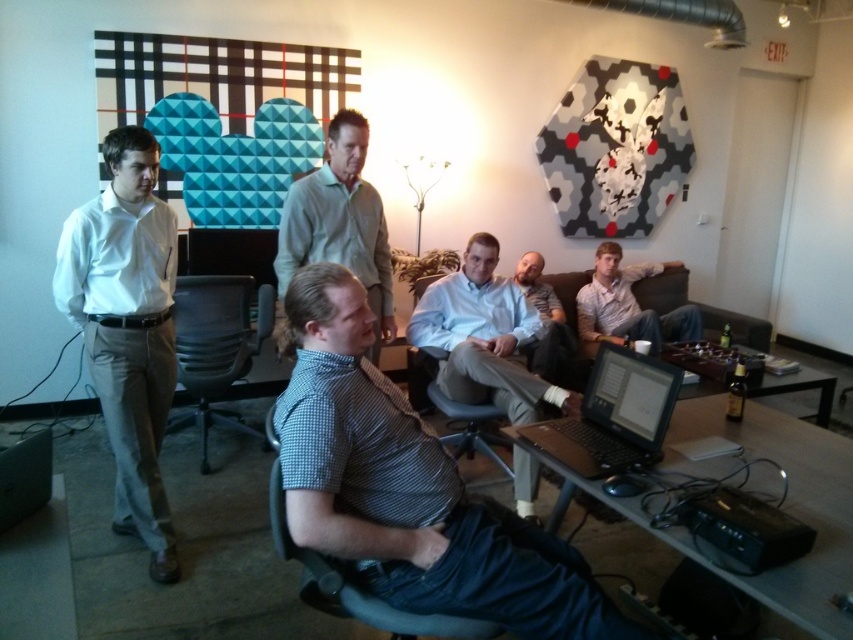
You are organizing a photo shoot and need to ensure that the checkered shirt at center and the light blue shirt at center are visible in the frame. Based on their sizes, which shirt should you focus on to ensure both are fully visible?

The checkered shirt at center has a larger size compared to light blue shirt at center, so focusing on the checkered shirt at center will help ensure both shirts are fully visible in the frame.

You are standing in the office and need to determine which of the two shirts, the light gray shirt at center or the light blue shirt at center, is taller. Based on the scene description, which one is taller?

The light gray shirt at center is taller than the light blue shirt at center according to the description.

You are organizing a photoshoot in this office and need to ensure that the white smooth shirt at left and the black plastic laptop at center are visible in the frame. Given that the camera has a fixed width of 50 cm, will both objects fit side by side horizontally?

The white smooth shirt at left is narrower than the black plastic laptop at center. However, without knowing the exact widths of both objects, it is impossible to determine if their combined width exceeds the camera frame of 50 cm. Additional measurements are required.